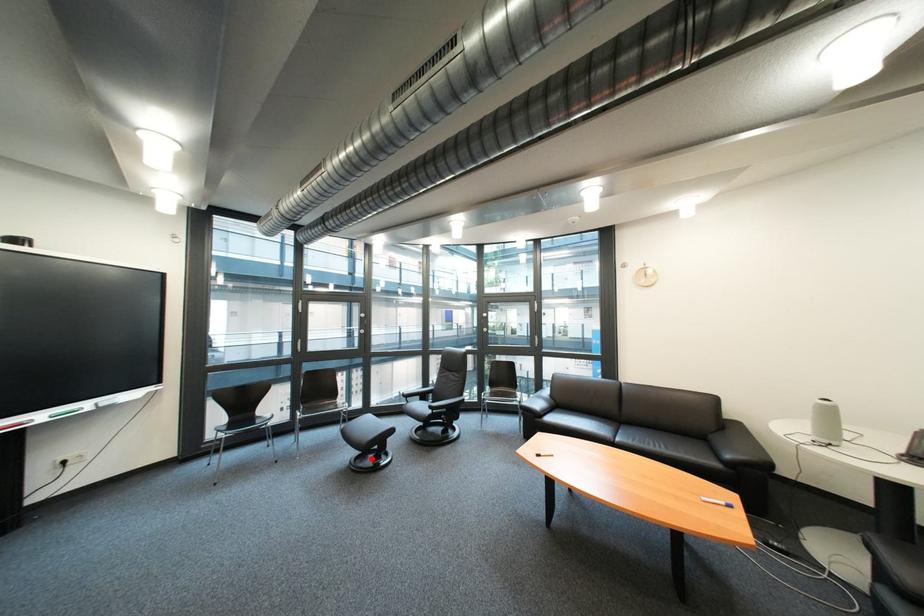
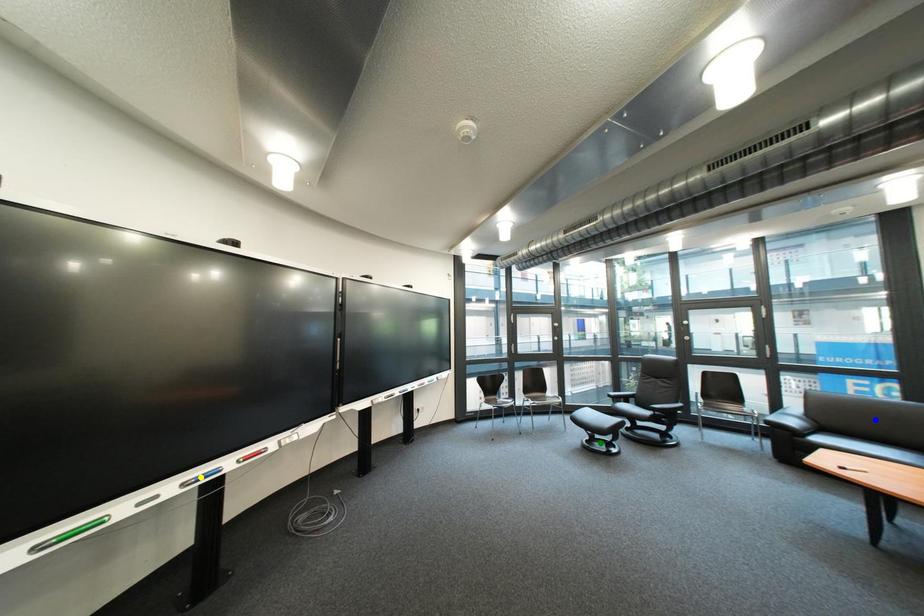
Question: I am providing you with two images of the same scene from different viewpoints. A red point is marked on the first image. You are given multiple points on the second image. Which spot in image 2 lines up with the point in image 1?

Choices:
 (A) green point
 (B) blue point
 (C) yellow point

Answer: (A)